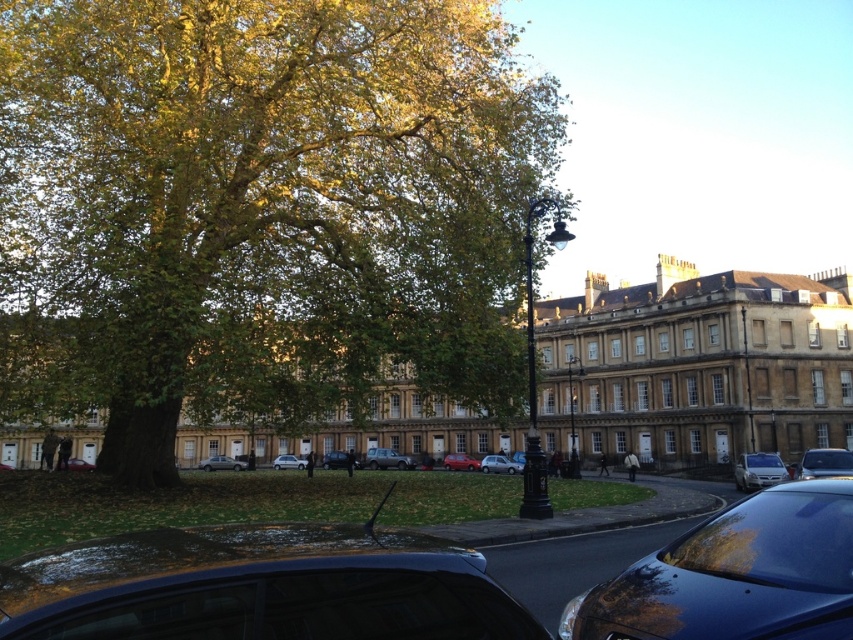
Does silver metallic van at lower right have a lesser height compared to matte silver suv at center?

In fact, silver metallic van at lower right may be taller than matte silver suv at center.

Is silver metallic van at lower right to the right of matte silver suv at center from the viewer's perspective?

Correct, you'll find silver metallic van at lower right to the right of matte silver suv at center.

Identify the location of silver metallic van at lower right. (758, 470).

Find the location of a particular element. The image size is (853, 640). silver metallic van at lower right is located at coordinates (758, 470).

Is brown stone building at center below silver metallic car at center?

Incorrect, brown stone building at center is not positioned below silver metallic car at center.

Does brown stone building at center have a larger size compared to silver metallic car at center?

Indeed, brown stone building at center has a larger size compared to silver metallic car at center.

What do you see at coordinates (697, 365) in the screenshot? This screenshot has height=640, width=853. I see `brown stone building at center` at bounding box center [697, 365].

The image size is (853, 640). In order to click on brown stone building at center in this screenshot , I will do `click(697, 365)`.

Between metallic silver car at lower right and metallic silver car at center, which one has more height?

metallic silver car at lower right is taller.

Is point (821, 472) more distant than point (370, 456)?

No, it is not.

The width and height of the screenshot is (853, 640). I want to click on metallic silver car at lower right, so click(x=824, y=464).